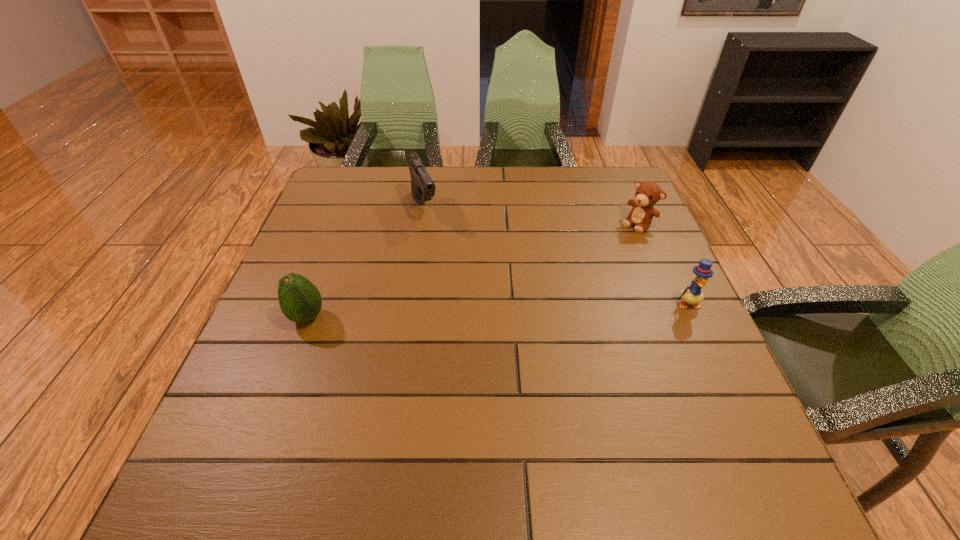
I want to click on free space between the duckling and the avocado, so click(x=497, y=310).

The width and height of the screenshot is (960, 540). In order to click on object that is the closest one to the teddy bear in this screenshot , I will do point(693,294).

Where is `the third closest object to the second object from left to right`? The height and width of the screenshot is (540, 960). the third closest object to the second object from left to right is located at coordinates (693, 294).

At what (x,y) coordinates should I click in order to perform the action: click on free space that satisfies the following two spatial constraints: 1. on the back side of the leftmost object; 2. on the right side of the teddy bear. Please return your answer as a coordinate pair (x, y). Image resolution: width=960 pixels, height=540 pixels. Looking at the image, I should click on (342, 224).